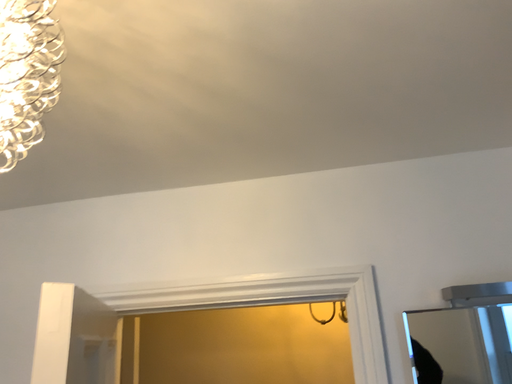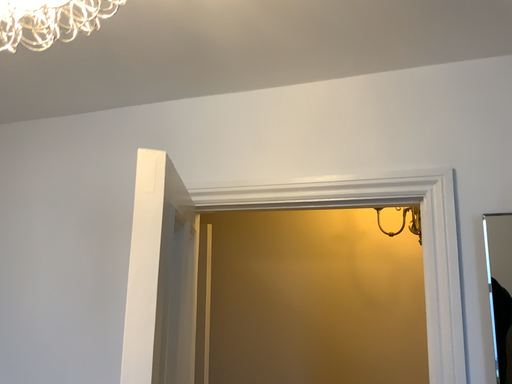
Question: How did the camera likely rotate when shooting the video?

Choices:
 (A) rotated left
 (B) rotated right

Answer: (A)